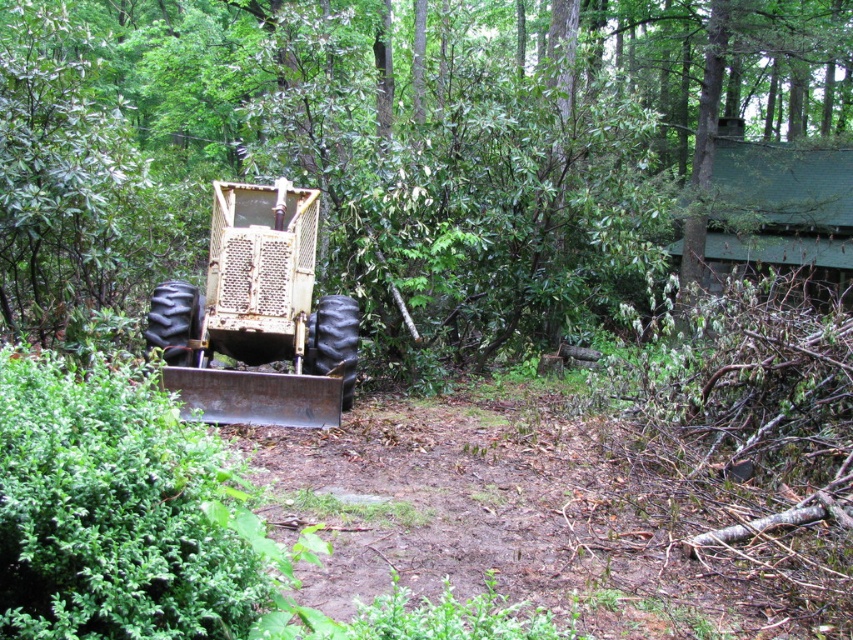
Between green leafy tree at center and rusty metal tractor at center, which one appears on the right side from the viewer's perspective?

green leafy tree at center is more to the right.

Which is in front, point (345, 172) or point (305, 413)?

Point (305, 413) is more forward.

Locate an element on the screen. This screenshot has width=853, height=640. green leafy tree at center is located at coordinates (351, 154).